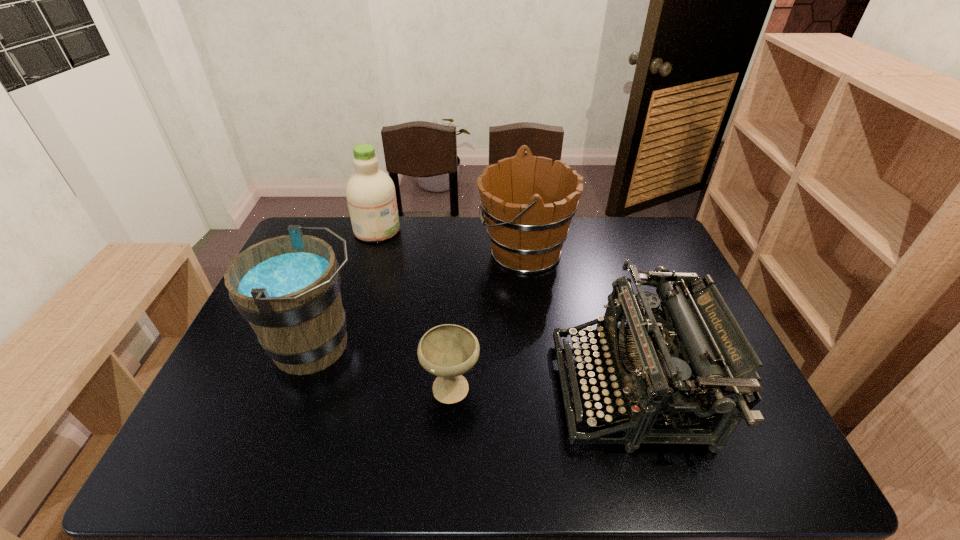
At what (x,y) coordinates should I click in order to perform the action: click on vacant space located 0.200m on the typing side of the second shortest object. Please return your answer as a coordinate pair (x, y). The image size is (960, 540). Looking at the image, I should click on (476, 389).

This screenshot has width=960, height=540. Find the location of `vacant area situated 0.260m on the typing side of the second shortest object`. vacant area situated 0.260m on the typing side of the second shortest object is located at coordinates (452, 389).

What are the coordinates of `vacant area located on the typing side of the second shortest object` in the screenshot? It's located at (501, 389).

Locate an element on the screen. The height and width of the screenshot is (540, 960). free space located 0.120m on the right of the shortest object is located at coordinates (529, 385).

Locate an element on the screen. This screenshot has width=960, height=540. cleansing agent that is at the far edge is located at coordinates (371, 197).

Identify the location of wine bucket that is positioned at the far edge. Image resolution: width=960 pixels, height=540 pixels. (528, 205).

Where is `object that is positioned at the near edge`? object that is positioned at the near edge is located at coordinates (662, 367).

Where is `object that is positioned at the left edge`? object that is positioned at the left edge is located at coordinates (288, 287).

At what (x,y) coordinates should I click in order to perform the action: click on object present at the right edge. Please return your answer as a coordinate pair (x, y). This screenshot has height=540, width=960. Looking at the image, I should click on (662, 367).

Where is `object present at the near right corner`? object present at the near right corner is located at coordinates (662, 367).